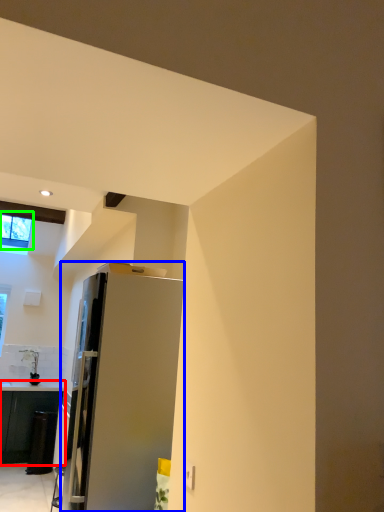
Question: Which object is the closest to the cabinetry (highlighted by a red box)? Choose among these: refrigerator (highlighted by a blue box) or window (highlighted by a green box).

Choices:
 (A) refrigerator
 (B) window

Answer: (B)